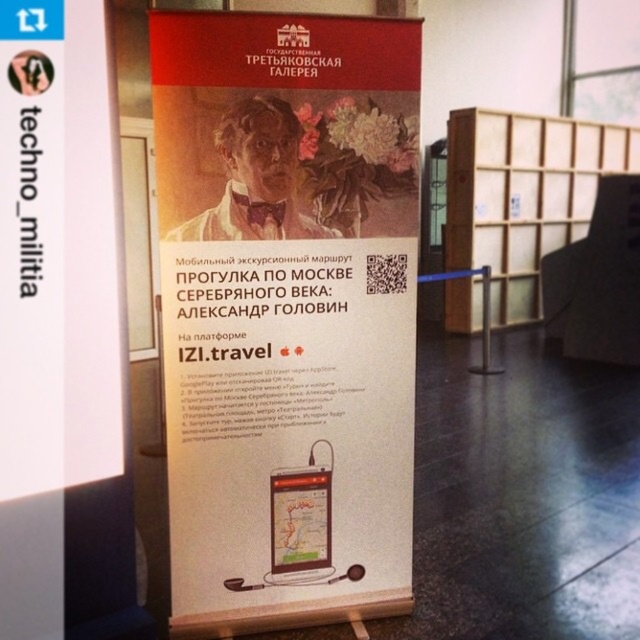
Question: Is white paper poster at center bigger than wooden at right?

Choices:
 (A) yes
 (B) no

Answer: (B)

Question: Is white paper poster at center further to camera compared to wooden at right?

Choices:
 (A) no
 (B) yes

Answer: (A)

Question: Which object appears closest to the camera in this image?

Choices:
 (A) wooden at right
 (B) white paper poster at center

Answer: (B)

Question: Observing the image, what is the correct spatial positioning of white paper poster at center in reference to wooden at right?

Choices:
 (A) left
 (B) right

Answer: (A)